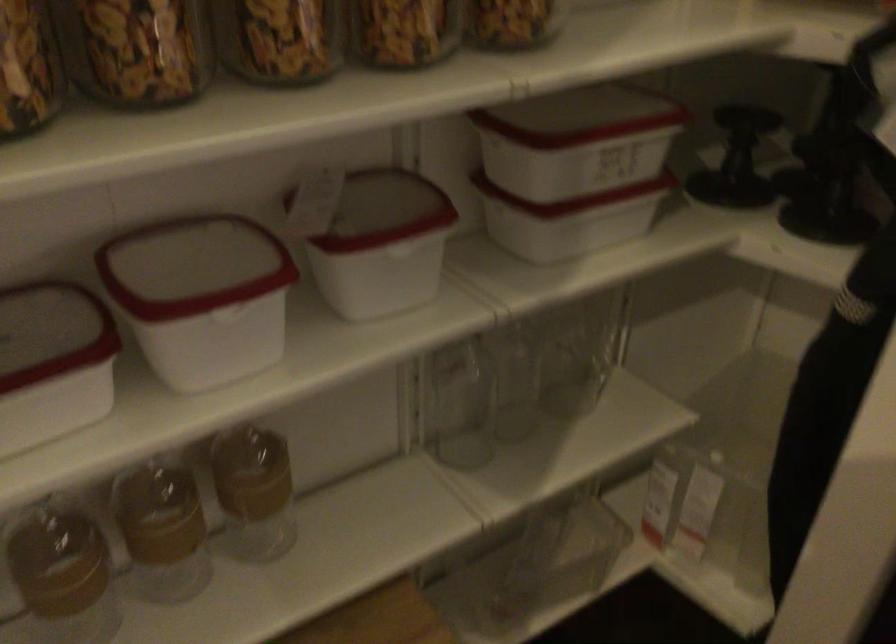
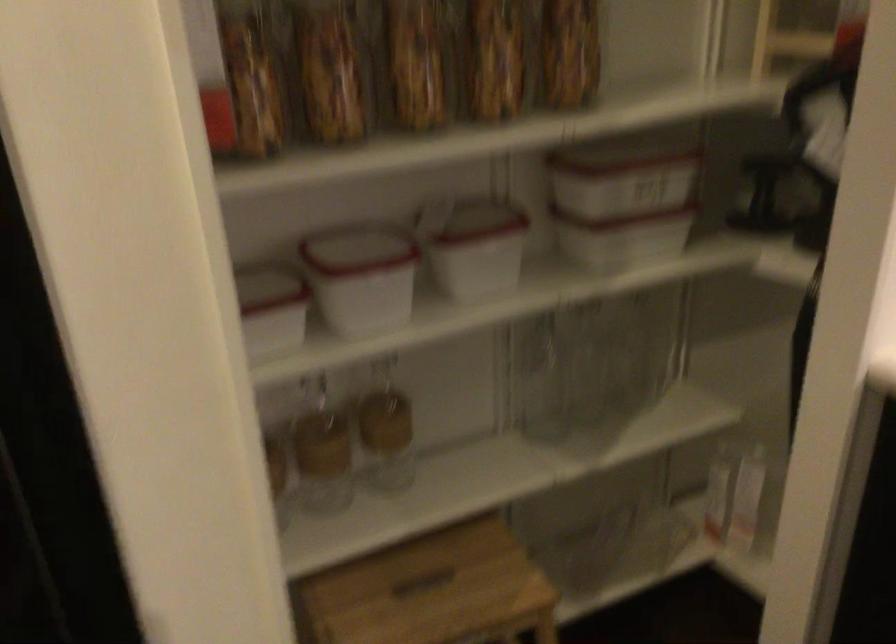
In the second image, find the point that corresponds to point (376, 247) in the first image.

(474, 245)